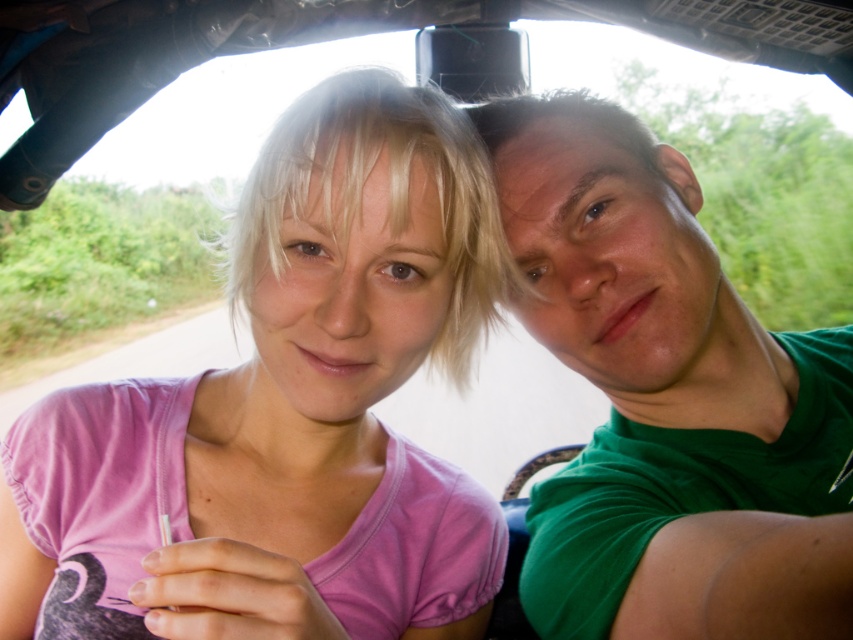
You are a photographer taking a photo of two people in a vehicle. You need to position a light source to the right of the green matte shirt at right to highlight it. Will the light source also illuminate the pink fabric shirt at center?

The pink fabric shirt at center is to the left of the green matte shirt at right. Since the light source is placed to the right of the green matte shirt at right, it would not directly illuminate the pink fabric shirt at center which is positioned to the left of the green shirt.